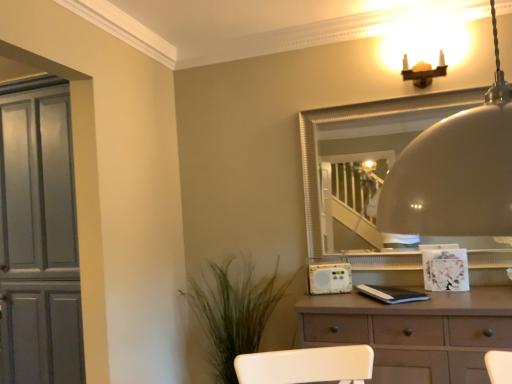
What is the approximate width of silver textured mirror at upper center?

It is 3.02 inches.

This screenshot has height=384, width=512. Describe the element at coordinates (329, 278) in the screenshot. I see `white plastic radio at center` at that location.

This screenshot has width=512, height=384. I want to click on matte gray cabinet at left, so click(39, 241).

Is matte gray cabinet at left spatially inside brown matte chest of drawers at center, or outside of it?

matte gray cabinet at left cannot be found inside brown matte chest of drawers at center.

Can you confirm if matte gray cabinet at left is shorter than brown matte chest of drawers at center?

No, matte gray cabinet at left is not shorter than brown matte chest of drawers at center.

Is matte gray cabinet at left turned away from brown matte chest of drawers at center?

→ No.

From a real-world perspective, between matte gray cabinet at left and brown matte chest of drawers at center, who is vertically higher?

matte gray cabinet at left, from a real-world perspective.

Is matte gray cabinet at left thinner than green leafy plant at lower left?

No, matte gray cabinet at left is not thinner than green leafy plant at lower left.

From a real-world perspective, is matte gray cabinet at left on top of green leafy plant at lower left?

Yes.

From the picture: Can you tell me how much matte gray cabinet at left and green leafy plant at lower left differ in facing direction?

0.745 degrees.

Is white plastic radio at center positioned far away from matte gray cabinet at left?

Yes, white plastic radio at center is far from matte gray cabinet at left.

Based on the photo, is white plastic radio at center not within matte gray cabinet at left?

Yes, white plastic radio at center is located beyond the bounds of matte gray cabinet at left.

Who is smaller, white plastic radio at center or matte gray cabinet at left?

With smaller size is white plastic radio at center.

Considering the relative sizes of silver textured mirror at upper center and brown matte chest of drawers at center in the image provided, is silver textured mirror at upper center taller than brown matte chest of drawers at center?

Indeed, silver textured mirror at upper center has a greater height compared to brown matte chest of drawers at center.

Consider the image. Between silver textured mirror at upper center and brown matte chest of drawers at center, which one is positioned in front?

brown matte chest of drawers at center is closer to the camera.

Is silver textured mirror at upper center thinner than brown matte chest of drawers at center?

Yes.

Is silver textured mirror at upper center not near brown matte chest of drawers at center?

No, silver textured mirror at upper center is not far away from brown matte chest of drawers at center.

Is silver textured mirror at upper center thinner than matte gray cabinet at left?

Indeed, silver textured mirror at upper center has a lesser width compared to matte gray cabinet at left.

Looking at this image, from the image's perspective, is silver textured mirror at upper center located beneath matte gray cabinet at left?

No, from the image's perspective, silver textured mirror at upper center is not below matte gray cabinet at left.

Which is more distant, (449, 239) or (49, 221)?

The point (449, 239) is behind.

Is white plastic radio at center oriented towards brown matte chest of drawers at center?

No, white plastic radio at center is not aimed at brown matte chest of drawers at center.

Is there a large distance between white plastic radio at center and brown matte chest of drawers at center?

No, white plastic radio at center is in close proximity to brown matte chest of drawers at center.

Can you tell me how much white plastic radio at center and brown matte chest of drawers at center differ in facing direction?

They differ by 22.6 degrees in their facing directions.

Which object is more forward, white plastic radio at center or brown matte chest of drawers at center?

brown matte chest of drawers at center is more forward.

You are a GUI agent. You are given a task and a screenshot of the screen. Output one action in this format:
    pyautogui.click(x=<x>, y=<y>)
    Task: Click on the cabinetry that is above the brown matte chest of drawers at center (from the image's perspective)
    
    Given the screenshot: What is the action you would take?
    pyautogui.click(x=39, y=241)

From the image's perspective, which one is positioned higher, brown matte chest of drawers at center or matte gray cabinet at left?

matte gray cabinet at left is shown above in the image.

Is brown matte chest of drawers at center not close to matte gray cabinet at left?

Yes, brown matte chest of drawers at center and matte gray cabinet at left are quite far apart.

Where is `cabinetry behind the brown matte chest of drawers at center`? cabinetry behind the brown matte chest of drawers at center is located at coordinates (39, 241).

Find the location of a particular element. houseplant lying on the right of matte gray cabinet at left is located at coordinates (233, 313).

Looking at this image, from the image, which object appears to be farther from brown matte chest of drawers at center, matte gray cabinet at left or white plastic radio at center?

Based on the image, matte gray cabinet at left appears to be further to brown matte chest of drawers at center.

Estimate the real-world distances between objects in this image. Which object is closer to silver textured mirror at upper center, brown matte chest of drawers at center or matte gray cabinet at left?

brown matte chest of drawers at center is positioned closer to the anchor silver textured mirror at upper center.

Based on their spatial positions, is brown matte chest of drawers at center or silver textured mirror at upper center further from white plastic radio at center?

Among the two, silver textured mirror at upper center is located further to white plastic radio at center.

Which object lies nearer to the anchor point brown matte chest of drawers at center, white plastic radio at center or green leafy plant at lower left?

white plastic radio at center is closer to brown matte chest of drawers at center.

From the picture: When comparing their distances from matte gray cabinet at left, does brown matte chest of drawers at center or green leafy plant at lower left seem closer?

green leafy plant at lower left is positioned closer to the anchor matte gray cabinet at left.

Looking at the image, which one is located further to green leafy plant at lower left, brown matte chest of drawers at center or white plastic radio at center?

brown matte chest of drawers at center is positioned further to the anchor green leafy plant at lower left.

Estimate the real-world distances between objects in this image. Which object is further from brown matte chest of drawers at center, silver textured mirror at upper center or green leafy plant at lower left?

green leafy plant at lower left lies further to brown matte chest of drawers at center than the other object.

Estimate the real-world distances between objects in this image. Which object is closer to green leafy plant at lower left, white plastic radio at center or brown matte chest of drawers at center?

The object closer to green leafy plant at lower left is white plastic radio at center.

This screenshot has height=384, width=512. Find the location of `the chest of drawers located between green leafy plant at lower left and silver textured mirror at upper center in the left-right direction`. the chest of drawers located between green leafy plant at lower left and silver textured mirror at upper center in the left-right direction is located at coordinates (415, 332).

At what (x,y) coordinates should I click in order to perform the action: click on houseplant between matte gray cabinet at left and white plastic radio at center in the horizontal direction. Please return your answer as a coordinate pair (x, y). This screenshot has width=512, height=384. Looking at the image, I should click on (233, 313).

Where is `appliance situated between matte gray cabinet at left and brown matte chest of drawers at center from left to right`? appliance situated between matte gray cabinet at left and brown matte chest of drawers at center from left to right is located at coordinates (329, 278).

Locate an element on the screen. The width and height of the screenshot is (512, 384). appliance between green leafy plant at lower left and brown matte chest of drawers at center is located at coordinates (329, 278).